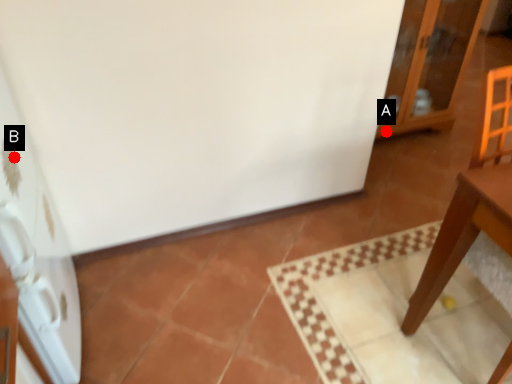
Question: Two points are circled on the image, labeled by A and B beside each circle. Which of the following is the farthest from the observer?

Choices:
 (A) A is further
 (B) B is further

Answer: (A)